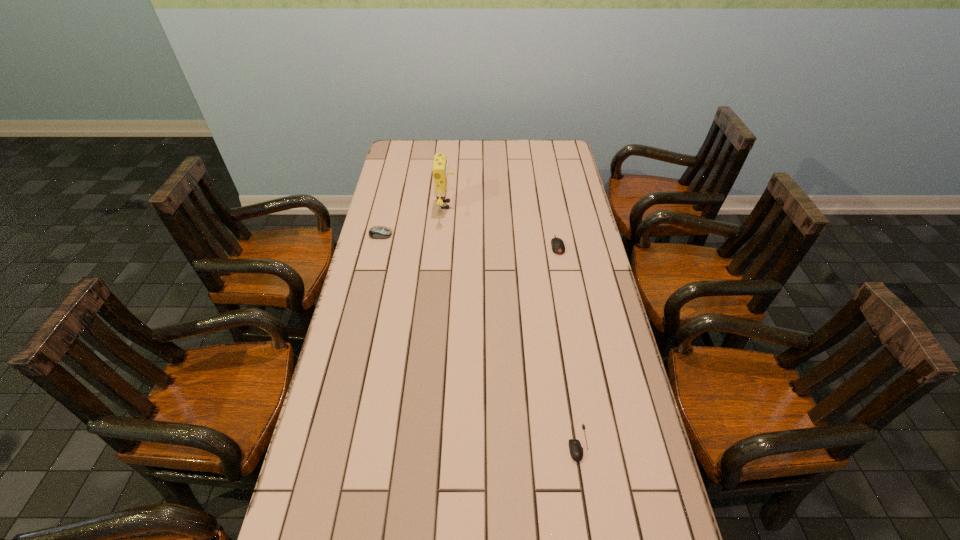
Find the location of a particular element. the farthest object is located at coordinates (440, 172).

Locate an element on the screen. the tallest object is located at coordinates (440, 172).

The height and width of the screenshot is (540, 960). I want to click on the leftmost mouse, so click(x=377, y=232).

I want to click on the shortest mouse, so click(576, 451).

Image resolution: width=960 pixels, height=540 pixels. What are the coordinates of `the nearest object` in the screenshot? It's located at (576, 451).

The image size is (960, 540). I want to click on free point located on the face of the second object from left to right, so click(x=478, y=205).

At what (x,y) coordinates should I click in order to perform the action: click on free space located on the wheel side of the leftmost object. Please return your answer as a coordinate pair (x, y). This screenshot has width=960, height=540. Looking at the image, I should click on (421, 235).

I want to click on vacant point located on the right of the shortest mouse, so click(x=639, y=443).

Where is `object located at the left edge`? object located at the left edge is located at coordinates (377, 232).

In order to click on vacant space at the far edge of the desktop in this screenshot , I will do `click(465, 154)`.